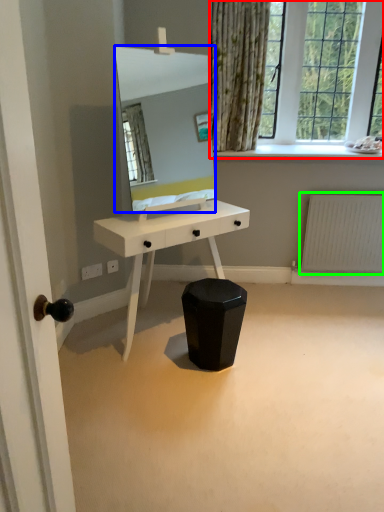
Question: Which object is positioned closest to window (highlighted by a red box)? Select from mirror (highlighted by a blue box) and radiator (highlighted by a green box).

Choices:
 (A) mirror
 (B) radiator

Answer: (B)